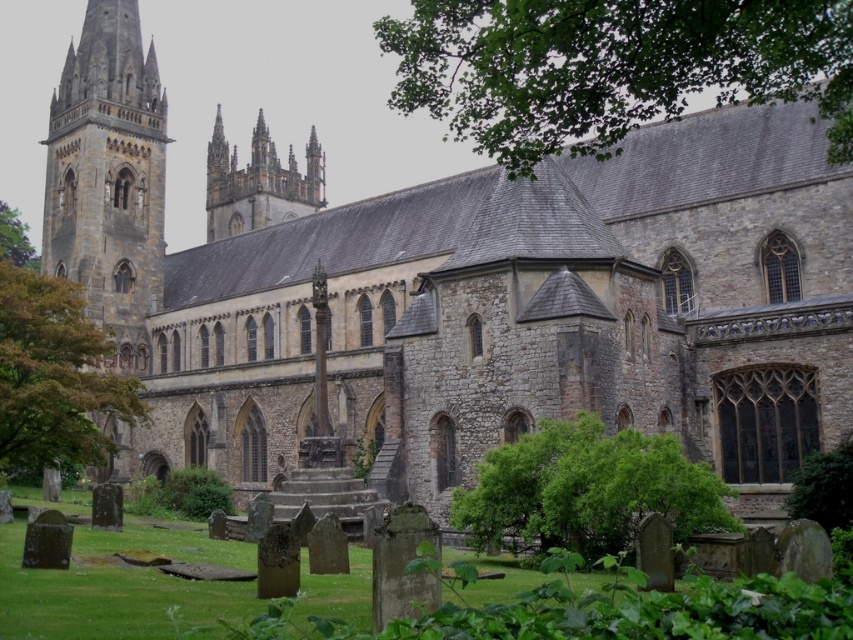
Question: Which is nearer to the stone gothic spires at upper center?

Choices:
 (A) green leafy tree at upper left
 (B) stone tower at left

Answer: (B)

Question: Among these points, which one is nearest to the camera?

Choices:
 (A) (131, 212)
 (B) (555, 429)

Answer: (B)

Question: Which of the following is the closest to the observer?

Choices:
 (A) (13, 221)
 (B) (811, 42)
 (C) (155, 180)

Answer: (B)

Question: Is stone tower at left bigger than green leafy tree at left?

Choices:
 (A) yes
 (B) no

Answer: (B)

Question: Does stone tower at left have a larger size compared to green leafy tree at left?

Choices:
 (A) yes
 (B) no

Answer: (B)

Question: Is stone tower at left further to the viewer compared to stone gothic spires at upper center?

Choices:
 (A) yes
 (B) no

Answer: (B)